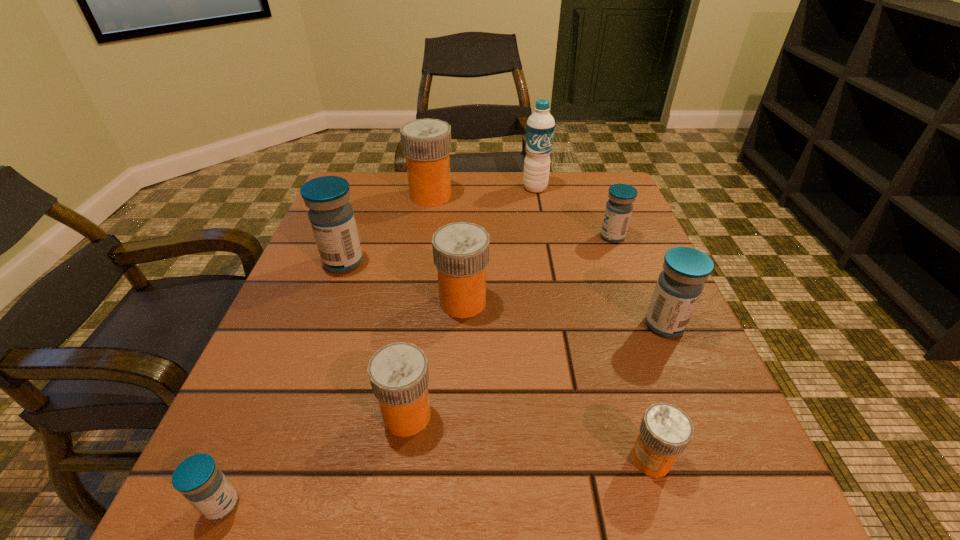
The image size is (960, 540). Identify the location of the second smallest blue medicine. (619, 207).

You are a GUI agent. You are given a task and a screenshot of the screen. Output one action in this format:
    pyautogui.click(x=<x>, y=<y>)
    Task: Click on the smallest orange medicine
    
    Given the screenshot: What is the action you would take?
    pyautogui.click(x=665, y=431)

You are a GUI agent. You are given a task and a screenshot of the screen. Output one action in this format:
    pyautogui.click(x=<x>, y=<y>)
    Task: Click on the sixth medicine from left to right
    
    Given the screenshot: What is the action you would take?
    pyautogui.click(x=665, y=431)

Image resolution: width=960 pixels, height=540 pixels. Identify the location of the nearest blue medicine. (203, 484).

Where is `the nearest object`? This screenshot has height=540, width=960. the nearest object is located at coordinates (203, 484).

What are the coordinates of `vacant space situated 0.130m on the label of the tallest object` in the screenshot? It's located at (541, 223).

At what (x,y) coordinates should I click in order to perform the action: click on vacant space located 0.390m on the label side of the biggest orange medicine. Please return your answer as a coordinate pair (x, y). Image resolution: width=960 pixels, height=540 pixels. Looking at the image, I should click on [x=604, y=195].

The image size is (960, 540). I want to click on vacant space situated on the back of the second farthest blue medicine, so click(x=355, y=231).

Find the location of a particular element. free region located on the label side of the third smallest orange medicine is located at coordinates (582, 302).

This screenshot has width=960, height=540. Find the location of `free space located 0.140m on the front of the second nearest blue medicine`. free space located 0.140m on the front of the second nearest blue medicine is located at coordinates click(x=701, y=411).